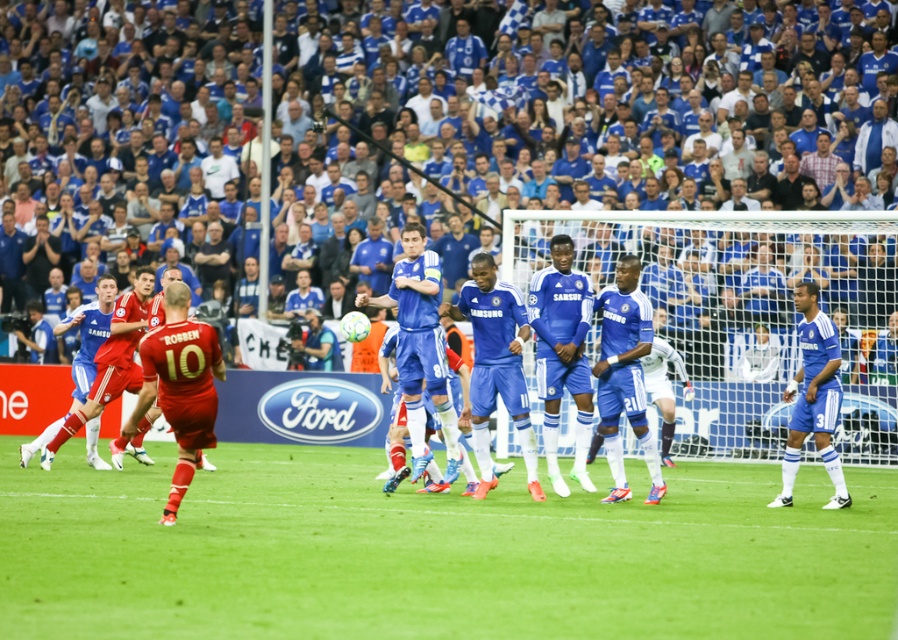
Question: Does blue jersey crowd at upper center have a lesser width compared to blue matte jersey at right?

Choices:
 (A) yes
 (B) no

Answer: (B)

Question: Which point is closer to the camera taking this photo?

Choices:
 (A) [222, 602]
 (B) [365, 304]
 (C) [873, 324]

Answer: (A)

Question: Among these points, which one is farthest from the camera?

Choices:
 (A) (806, 378)
 (B) (788, 244)
 (C) (482, 291)
 (D) (46, 584)

Answer: (B)

Question: Is green grass at center above blue matte soccer players at center?

Choices:
 (A) yes
 (B) no

Answer: (B)

Question: Which point appears closest to the camera in this image?

Choices:
 (A) click(826, 348)
 (B) click(524, 522)
 (C) click(885, 179)

Answer: (B)

Question: Can you confirm if green grass at center is bigger than blue jersey crowd at upper center?

Choices:
 (A) yes
 (B) no

Answer: (B)